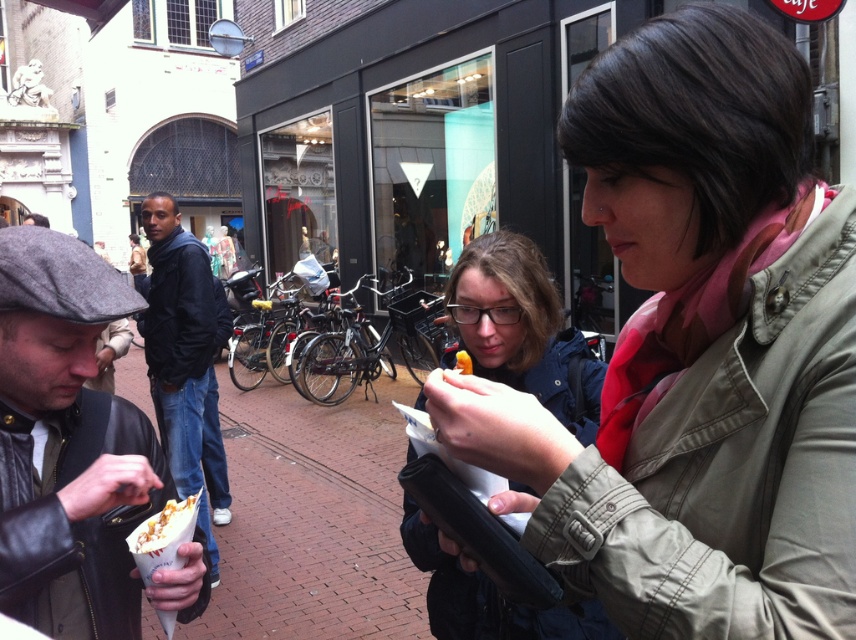
Question: Is matte black jacket at center bigger than yellow matte food at center?

Choices:
 (A) no
 (B) yes

Answer: (B)

Question: Which object is the farthest from the brick pavement at center?

Choices:
 (A) yellow matte food at center
 (B) crumbly brown pastry at lower left

Answer: (A)

Question: Is light brown fabric jacket at center bigger than yellow matte food at center?

Choices:
 (A) yes
 (B) no

Answer: (A)

Question: Considering the real-world distances, which object is farthest from the crumbly brown pastry at lower left?

Choices:
 (A) matte black jacket at center
 (B) leather jacket at lower left
 (C) dark blue jacket at left

Answer: (C)

Question: Among these objects, which one is nearest to the camera?

Choices:
 (A) leather jacket at lower left
 (B) crumbly brown pastry at lower left

Answer: (A)

Question: Does brick pavement at center have a lesser width compared to matte black jacket at center?

Choices:
 (A) yes
 (B) no

Answer: (B)